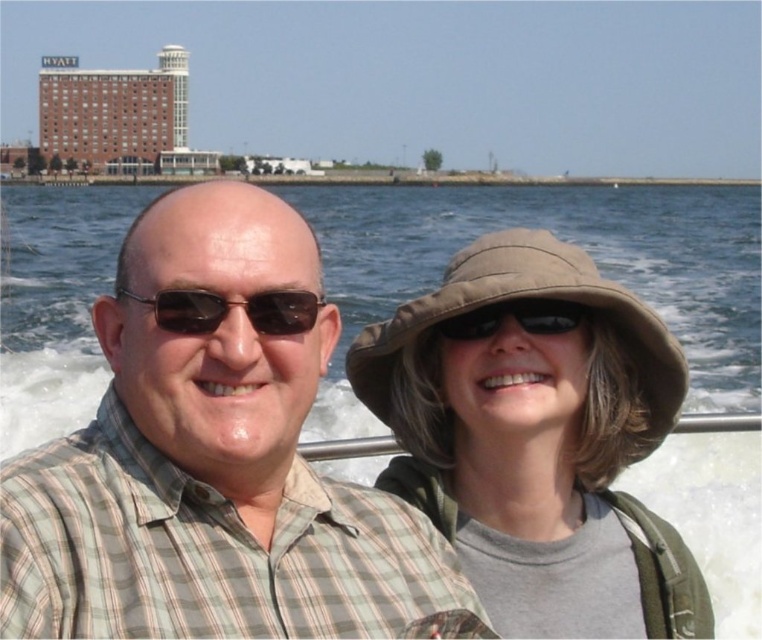
You are a photographer trying to capture a closeup of the checkered fabric shirt at center and the matte black sunglasses at center. Which object should you zoom in on to ensure both are in frame without moving the camera?

The checkered fabric shirt at center is wider than the matte black sunglasses at center, so you should zoom in on the checkered fabric shirt at center to ensure both are in frame without moving the camera.

You are a photographer trying to capture the matte black sunglasses at center and the matte black goggles at upper center in a single shot. Which object should you focus on first to ensure both are in frame?

The matte black sunglasses at center should be focused on first since it is above the matte black goggles at upper center, ensuring both are within the frame.